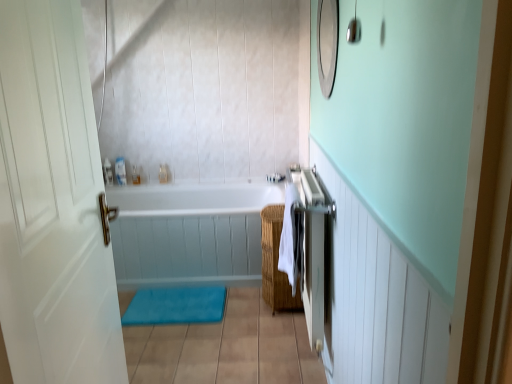
Locate an element on the screen. The width and height of the screenshot is (512, 384). vacant area that lies between woven brown basket at center and blue fabric bath mat at lower center is located at coordinates (243, 300).